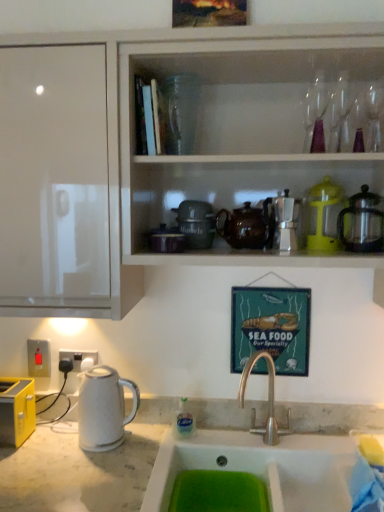
Question: Is white plastic electric outlet at lower left, which is the second electric outlet from left to right, wider or thinner than white glossy cabinet at upper center?

Choices:
 (A) thin
 (B) wide

Answer: (A)

Question: Is white plastic electric outlet at lower left, acting as the 1th electric outlet starting from the right, inside or outside of white glossy cabinet at upper center?

Choices:
 (A) inside
 (B) outside

Answer: (B)

Question: Which object is the closest to the metallic silver coffee maker at upper center, the first appliance when ordered from left to right?

Choices:
 (A) red plastic switch at lower left, which is counted as the 2th electric outlet, starting from the right
 (B) white plastic electric outlet at lower left, which is the second electric outlet from left to right
 (C) white glossy cabinet at upper center
 (D) yellow translucent jug at upper right, placed as the 2th appliance when sorted from left to right
 (E) satin silver coffee pot at upper right, which is the 3th appliance in left-to-right order

Answer: (D)

Question: Estimate the real-world distances between objects in this image. Which object is closer to the metallic silver coffee maker at upper center, arranged as the 3th appliance when viewed from the right?

Choices:
 (A) satin silver coffee pot at upper right, acting as the 1th appliance starting from the right
 (B) red plastic switch at lower left, placed as the first electric outlet when sorted from left to right
 (C) metallic signboard at center
 (D) yellow translucent jug at upper right, which is the second appliance in right-to-left order
 (E) white glossy electric kettle at left

Answer: (D)